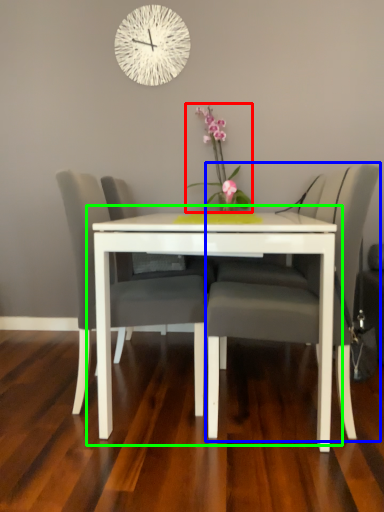
Question: Based on their relative distances, which object is nearer to floral arrangement (highlighted by a red box)? Choose from chair (highlighted by a blue box) and table (highlighted by a green box).

Choices:
 (A) chair
 (B) table

Answer: (A)